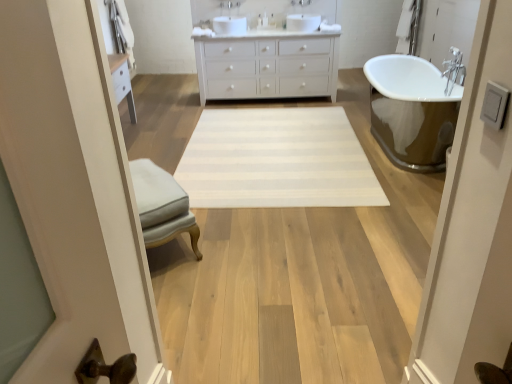
You are a GUI agent. You are given a task and a screenshot of the screen. Output one action in this format:
    pyautogui.click(x=<x>, y=<y>)
    Task: Click on the free location in front of white matte cabinet at center
    The height and width of the screenshot is (384, 512).
    Given the screenshot: What is the action you would take?
    pyautogui.click(x=312, y=120)